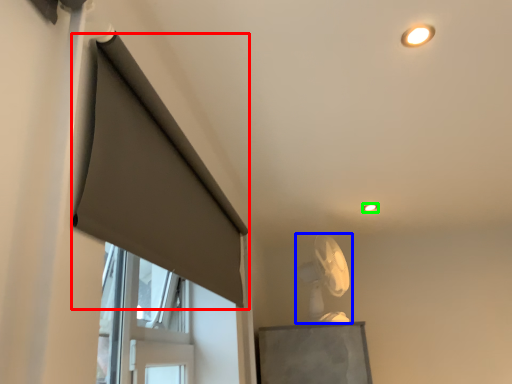
Question: Estimate the real-world distances between objects in this image. Which object is closer to curtain (highlighted by a red box), fan (highlighted by a blue box) or lighting (highlighted by a green box)?

Choices:
 (A) fan
 (B) lighting

Answer: (A)